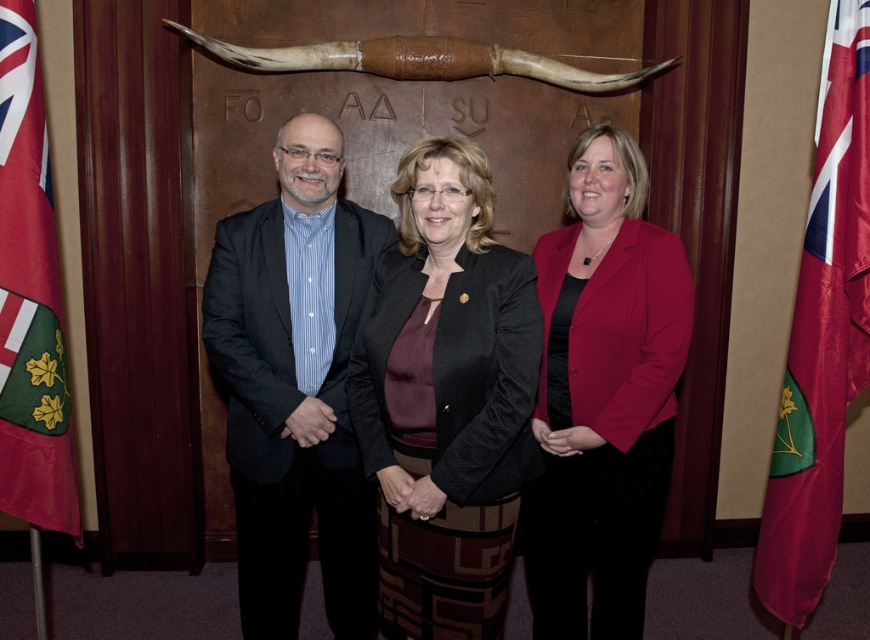
Question: Among these objects, which one is farthest from the camera?

Choices:
 (A) red satin flag at right
 (B) matte red blazer at center
 (C) matte black suit at left
 (D) black textured blazer at center

Answer: (C)

Question: Is matte black suit at left behind red fabric flag at left?

Choices:
 (A) no
 (B) yes

Answer: (B)

Question: Based on their relative distances, which object is farther from the matte black suit at left?

Choices:
 (A) red satin flag at right
 (B) black textured blazer at center

Answer: (A)

Question: Is matte black suit at left further to the viewer compared to matte red blazer at center?

Choices:
 (A) yes
 (B) no

Answer: (A)

Question: Which point is closer to the camera?

Choices:
 (A) black textured blazer at center
 (B) red fabric flag at left
 (C) red satin flag at right

Answer: (A)

Question: From the image, what is the correct spatial relationship of matte black suit at left in relation to red fabric flag at left?

Choices:
 (A) right
 (B) left

Answer: (A)